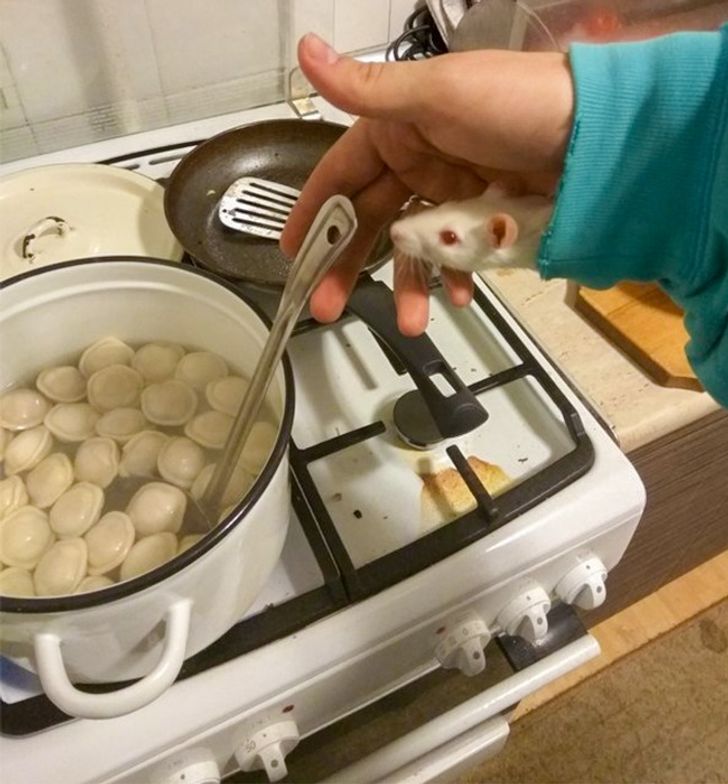
Where is `crockpot`? Image resolution: width=728 pixels, height=784 pixels. crockpot is located at coordinates (207, 601).